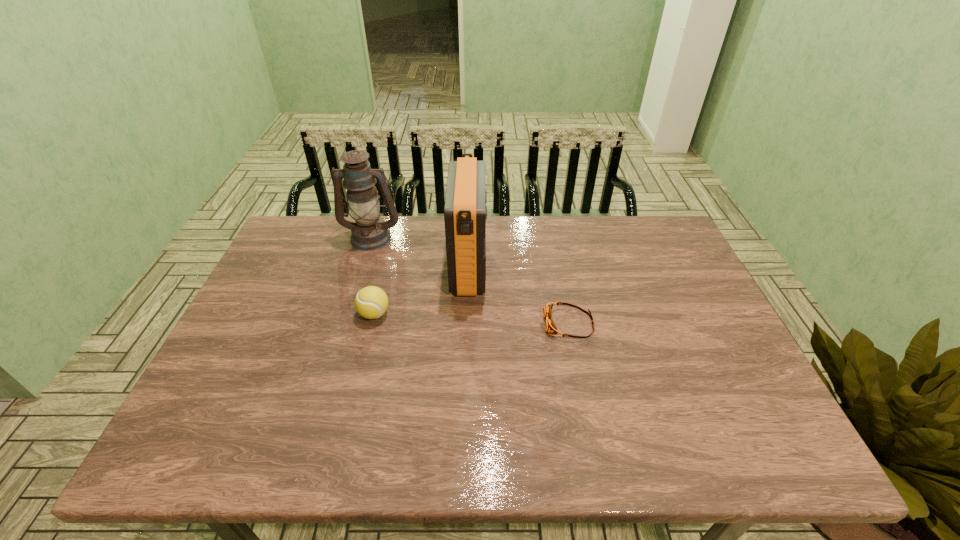
The width and height of the screenshot is (960, 540). Find the location of `vacant region located 0.080m with the lenses facing forward on the rightmost object`. vacant region located 0.080m with the lenses facing forward on the rightmost object is located at coordinates (514, 324).

You are a GUI agent. You are given a task and a screenshot of the screen. Output one action in this format:
    pyautogui.click(x=<x>, y=<y>)
    Task: Click on the oil lamp positioned at the far edge
    Image resolution: width=960 pixels, height=540 pixels.
    Given the screenshot: What is the action you would take?
    pyautogui.click(x=369, y=232)

In order to click on radio receiver at the far edge in this screenshot , I will do `click(465, 211)`.

In the image, there is a desktop. Where is `vacant space at the far edge`? This screenshot has height=540, width=960. vacant space at the far edge is located at coordinates (616, 251).

Locate an element on the screen. The image size is (960, 540). free space at the near edge of the desktop is located at coordinates (521, 439).

The height and width of the screenshot is (540, 960). I want to click on free space at the left edge, so click(249, 325).

Find the location of a particular element. free space at the right edge of the desktop is located at coordinates (661, 292).

Locate an element on the screen. The image size is (960, 540). free location at the far left corner of the desktop is located at coordinates click(297, 234).

Identify the location of blank space at the far right corner of the desktop. click(x=678, y=255).

Locate an element on the screen. This screenshot has height=540, width=960. free space between the oil lamp and the third object from left to right is located at coordinates (420, 252).